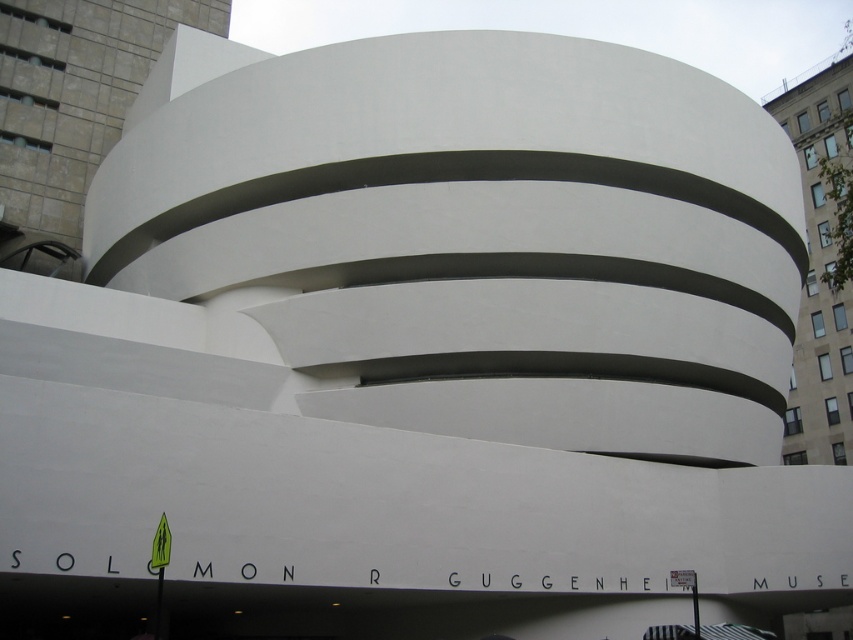
You are an architect analyzing the Solomon R. Guggenheim Museum. You notice two elements, the white smooth concrete at upper left and the white smooth building at upper right. Which one is smaller in size?

The white smooth concrete at upper left is smaller in size compared to the white smooth building at upper right according to the description.

You are standing in front of the Solomon R. Guggenheim Museum and notice two white structures in the upper part of the building. The white smooth concrete at upper left and the white smooth building at upper right. Which one appears closer to you?

The white smooth concrete at upper left appears closer because the white smooth building at upper right is positioned behind it.

You are an architect visiting the Solomon R. Guggenheim Museum. You notice two white smooth structures in the upper part of the building. One is labeled as white smooth concrete at upper left and the other as white smooth building at upper right. If you want to place a 200 feet long temporary walkway between them, will there be enough space?

The white smooth concrete at upper left is 218.85 feet away from the white smooth building at upper right. Since the distance between them is greater than the 200 feet length of the walkway, there is sufficient space to place the temporary walkway between them.